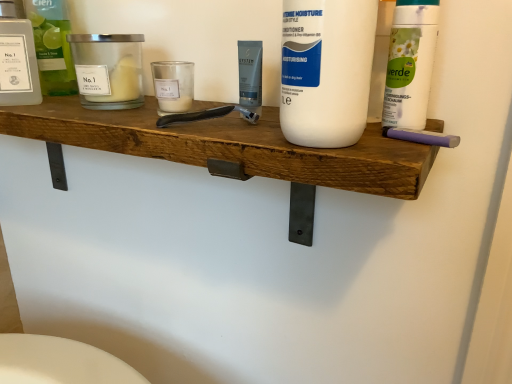
Measure the distance between point (344,121) and camera.

The depth of point (344,121) is 15.31 inches.

What do you see at coordinates (326, 70) in the screenshot? I see `white matte bottle at center, which is the second cleaning product in right-to-left order` at bounding box center [326, 70].

In order to face wooden shelf at center, should I rotate leftwards or rightwards?

You should look left and rotate roughly 17.967 degrees.

What do you see at coordinates (108, 70) in the screenshot? The image size is (512, 384). I see `matte glass candle at left, which is the 2th personal care from left to right` at bounding box center [108, 70].

Describe the element at coordinates (17, 60) in the screenshot. I see `transparent plastic bottle at left, the 1th personal care when ordered from left to right` at that location.

At what (x,y) coordinates should I click in order to perform the action: click on purple rubber eraser at right, the 1th personal care positioned from the right. Please return your answer as a coordinate pair (x, y). Image resolution: width=512 pixels, height=384 pixels. Looking at the image, I should click on (422, 137).

Where is `white matte bottle at upper right, which is the first cleaning product in right-to-left order`? The height and width of the screenshot is (384, 512). white matte bottle at upper right, which is the first cleaning product in right-to-left order is located at coordinates 410,63.

Between matte glass candle at left, which is the 2th personal care from left to right, and white matte bottle at upper right, which is the first cleaning product in right-to-left order, which one has less height?

With less height is matte glass candle at left, which is the 2th personal care from left to right.

Is matte glass candle at left, the second personal care from the right, oriented away from white matte bottle at upper right, which ranks as the 2th cleaning product in front-to-back order?

matte glass candle at left, the second personal care from the right, is not turned away from white matte bottle at upper right, which ranks as the 2th cleaning product in front-to-back order.

How different are the orientations of matte glass candle at left, the second personal care from the right, and white matte bottle at upper right, which is the first cleaning product in right-to-left order, in degrees?

The angle between the facing direction of matte glass candle at left, the second personal care from the right, and the facing direction of white matte bottle at upper right, which is the first cleaning product in right-to-left order, is 0.00533 degrees.

Can you confirm if matte glass candle at left, which is the 2th personal care from left to right, is smaller than white matte bottle at upper right, the third cleaning product in the left-to-right sequence?

No.

Does transparent plastic bottle at left, the 1th personal care when ordered from left to right, have a lesser width compared to wooden shelf at center?

Yes, transparent plastic bottle at left, the 1th personal care when ordered from left to right, is thinner than wooden shelf at center.

Who is more distant, transparent plastic bottle at left, the 1th personal care when ordered from left to right, or wooden shelf at center?

transparent plastic bottle at left, the 1th personal care when ordered from left to right.

Could you tell me if transparent plastic bottle at left, the third personal care when ordered from right to left, is turned towards wooden shelf at center?

No, transparent plastic bottle at left, the third personal care when ordered from right to left, is not turned towards wooden shelf at center.

From a real-world perspective, is transparent plastic bottle at left, the third personal care when ordered from right to left, located higher than wooden shelf at center?

Yes, from a real-world perspective, transparent plastic bottle at left, the third personal care when ordered from right to left, is on top of wooden shelf at center.

Is translucent glass bottle at upper left, which appears as the 1th cleaning product when viewed from the left, facing towards white matte bottle at upper right, the third cleaning product in the left-to-right sequence?

No, translucent glass bottle at upper left, which appears as the 1th cleaning product when viewed from the left, is not oriented towards white matte bottle at upper right, the third cleaning product in the left-to-right sequence.

Does translucent glass bottle at upper left, arranged as the first cleaning product when viewed from the back, have a greater width compared to white matte bottle at upper right, the second cleaning product viewed from the back?

In fact, translucent glass bottle at upper left, arranged as the first cleaning product when viewed from the back, might be narrower than white matte bottle at upper right, the second cleaning product viewed from the back.

Which of these two, translucent glass bottle at upper left, which is counted as the 3th cleaning product, starting from the right, or white matte bottle at upper right, which ranks as the 2th cleaning product in front-to-back order, is bigger?

translucent glass bottle at upper left, which is counted as the 3th cleaning product, starting from the right.

Considering the positions of objects matte glass candle at left, the second personal care from the right, and wooden shelf at center in the image provided, who is more to the left, matte glass candle at left, the second personal care from the right, or wooden shelf at center?

wooden shelf at center.

Is matte glass candle at left, which is the 2th personal care from left to right, smaller than wooden shelf at center?

Yes.

Does matte glass candle at left, which is the 2th personal care from left to right, have a greater width compared to wooden shelf at center?

No.

Considering the relative positions of translucent glass bottle at upper left, which is counted as the 3th cleaning product, starting from the right, and transparent plastic bottle at left, the 1th personal care when ordered from left to right, in the image provided, is translucent glass bottle at upper left, which is counted as the 3th cleaning product, starting from the right, to the right of transparent plastic bottle at left, the 1th personal care when ordered from left to right, from the viewer's perspective?

Yes, translucent glass bottle at upper left, which is counted as the 3th cleaning product, starting from the right, is to the right of transparent plastic bottle at left, the 1th personal care when ordered from left to right.

Does translucent glass bottle at upper left, arranged as the first cleaning product when viewed from the back, have a larger size compared to transparent plastic bottle at left, the third personal care when ordered from right to left?

Indeed, translucent glass bottle at upper left, arranged as the first cleaning product when viewed from the back, has a larger size compared to transparent plastic bottle at left, the third personal care when ordered from right to left.

Who is more distant, translucent glass bottle at upper left, which appears as the 1th cleaning product when viewed from the left, or transparent plastic bottle at left, the 1th personal care when ordered from left to right?

Positioned behind is translucent glass bottle at upper left, which appears as the 1th cleaning product when viewed from the left.

Is white matte bottle at center, marked as the 3th cleaning product in a back-to-front arrangement, next to purple rubber eraser at right, marked as the 3th personal care in a left-to-right arrangement, and touching it?

white matte bottle at center, marked as the 3th cleaning product in a back-to-front arrangement, is not next to purple rubber eraser at right, marked as the 3th personal care in a left-to-right arrangement, and they're not touching.

In terms of size, does white matte bottle at center, marked as the 1th cleaning product in a front-to-back arrangement, appear bigger or smaller than purple rubber eraser at right, marked as the 3th personal care in a left-to-right arrangement?

Clearly, white matte bottle at center, marked as the 1th cleaning product in a front-to-back arrangement, is larger in size than purple rubber eraser at right, marked as the 3th personal care in a left-to-right arrangement.

From a real-world perspective, between white matte bottle at center, the second cleaning product viewed from the left, and purple rubber eraser at right, the 1th personal care positioned from the right, who is vertically lower?

purple rubber eraser at right, the 1th personal care positioned from the right.

Considering the relative sizes of white matte bottle at center, marked as the 1th cleaning product in a front-to-back arrangement, and purple rubber eraser at right, marked as the 3th personal care in a left-to-right arrangement, in the image provided, is white matte bottle at center, marked as the 1th cleaning product in a front-to-back arrangement, thinner than purple rubber eraser at right, marked as the 3th personal care in a left-to-right arrangement,?

In fact, white matte bottle at center, marked as the 1th cleaning product in a front-to-back arrangement, might be wider than purple rubber eraser at right, marked as the 3th personal care in a left-to-right arrangement.

Is point (291, 62) closer or farther from the camera than point (86, 89)?

Point (291, 62) is closer to the camera than point (86, 89).

From the image's perspective, which one is positioned lower, white matte bottle at center, which is the second cleaning product in right-to-left order, or matte glass candle at left, the second personal care from the right?

white matte bottle at center, which is the second cleaning product in right-to-left order.

In the scene shown: Does white matte bottle at center, marked as the 1th cleaning product in a front-to-back arrangement, appear on the left side of matte glass candle at left, which is the 2th personal care from left to right?

Incorrect, white matte bottle at center, marked as the 1th cleaning product in a front-to-back arrangement, is not on the left side of matte glass candle at left, which is the 2th personal care from left to right.

This screenshot has height=384, width=512. In order to click on cleaning product that is the 1st one when counting downward from the matte glass candle at left, which is the 2th personal care from left to right (from the image's perspective) in this screenshot , I will do `click(410, 63)`.

Which personal care is the 3rd one when counting from the back of the wooden shelf at center? Please provide its 2D coordinates.

[(17, 60)]

Estimate the real-world distances between objects in this image. Which object is further from matte glass candle at left, which is the 2th personal care from left to right, white matte bottle at center, marked as the 3th cleaning product in a back-to-front arrangement, or transparent plastic bottle at left, the 1th personal care when ordered from left to right?

white matte bottle at center, marked as the 3th cleaning product in a back-to-front arrangement, lies further to matte glass candle at left, which is the 2th personal care from left to right, than the other object.

Estimate the real-world distances between objects in this image. Which object is closer to white matte bottle at upper right, the second cleaning product viewed from the back, matte glass candle at left, the second personal care from the right, or wooden shelf at center?

Based on the image, wooden shelf at center appears to be nearer to white matte bottle at upper right, the second cleaning product viewed from the back.

Looking at the image, which one is located further to purple rubber eraser at right, the 1th personal care positioned from the right, wooden shelf at center or white matte bottle at center, marked as the 3th cleaning product in a back-to-front arrangement?

Based on the image, wooden shelf at center appears to be further to purple rubber eraser at right, the 1th personal care positioned from the right.

Considering their positions, is wooden shelf at center positioned further to white matte bottle at upper right, the third cleaning product in the left-to-right sequence, than white matte bottle at center, the second cleaning product viewed from the left?

The object further to white matte bottle at upper right, the third cleaning product in the left-to-right sequence, is wooden shelf at center.

Looking at the image, which one is located closer to wooden shelf at center, white matte bottle at center, marked as the 3th cleaning product in a back-to-front arrangement, or white matte bottle at upper right, the third cleaning product in the left-to-right sequence?

Based on the image, white matte bottle at center, marked as the 3th cleaning product in a back-to-front arrangement, appears to be nearer to wooden shelf at center.

From the image, which object appears to be nearer to translucent glass bottle at upper left, arranged as the first cleaning product when viewed from the back, white matte bottle at center, which is the second cleaning product in right-to-left order, or transparent plastic bottle at left, the third personal care when ordered from right to left?

transparent plastic bottle at left, the third personal care when ordered from right to left, is closer to translucent glass bottle at upper left, arranged as the first cleaning product when viewed from the back.

From the picture: Estimate the real-world distances between objects in this image. Which object is closer to purple rubber eraser at right, the 1th personal care positioned from the right, white matte bottle at center, which is the second cleaning product in right-to-left order, or translucent glass bottle at upper left, placed as the third cleaning product when sorted from front to back?

white matte bottle at center, which is the second cleaning product in right-to-left order, is positioned closer to the anchor purple rubber eraser at right, the 1th personal care positioned from the right.

When comparing their distances from translucent glass bottle at upper left, which appears as the 1th cleaning product when viewed from the left, does matte glass candle at left, the second personal care from the right, or white matte bottle at upper right, which ranks as the 2th cleaning product in front-to-back order, seem further?

Among the two, white matte bottle at upper right, which ranks as the 2th cleaning product in front-to-back order, is located further to translucent glass bottle at upper left, which appears as the 1th cleaning product when viewed from the left.

Identify the location of shelf between transparent plastic bottle at left, the third personal care when ordered from right to left, and white matte bottle at center, marked as the 3th cleaning product in a back-to-front arrangement. This screenshot has height=384, width=512. (229, 151).

The height and width of the screenshot is (384, 512). I want to click on cleaning product located between transparent plastic bottle at left, the 1th personal care when ordered from left to right, and white matte bottle at center, marked as the 3th cleaning product in a back-to-front arrangement, in the left-right direction, so click(53, 46).

This screenshot has width=512, height=384. Identify the location of personal care situated between white matte bottle at center, marked as the 1th cleaning product in a front-to-back arrangement, and white matte bottle at upper right, which is the first cleaning product in right-to-left order, from left to right. (x=422, y=137).

I want to click on personal care between transparent plastic bottle at left, the 1th personal care when ordered from left to right, and white matte bottle at center, marked as the 1th cleaning product in a front-to-back arrangement, so click(x=108, y=70).